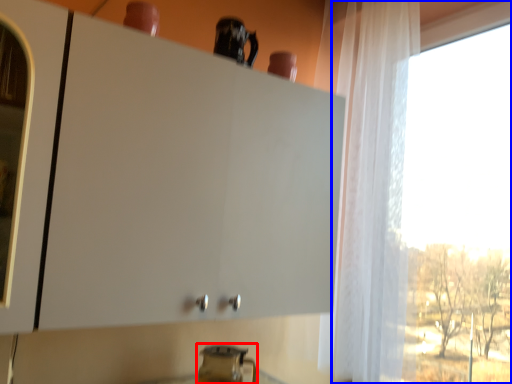
Question: Which object appears closest to the camera in this image, appliance (highlighted by a red box) or window (highlighted by a blue box)?

Choices:
 (A) appliance
 (B) window

Answer: (B)